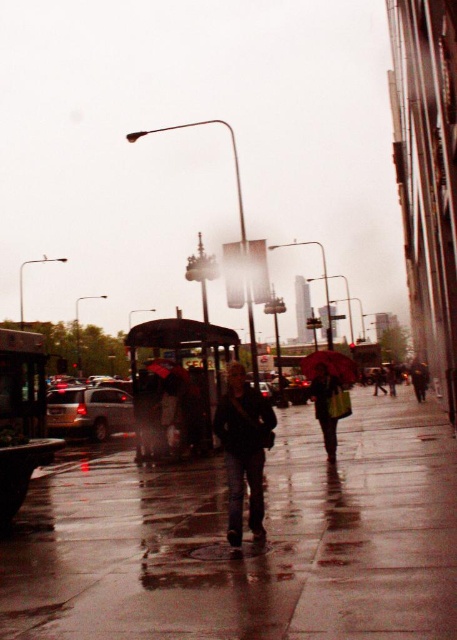
This screenshot has width=457, height=640. Find the location of `black plastic bus stop at center`. black plastic bus stop at center is located at coordinates (176, 385).

Does black plastic bus stop at center appear on the left side of raincoat fabric umbrella at center?

Correct, you'll find black plastic bus stop at center to the left of raincoat fabric umbrella at center.

Where is `black plastic bus stop at center`? black plastic bus stop at center is located at coordinates (176, 385).

In order to click on black plastic bus stop at center in this screenshot , I will do `click(176, 385)`.

Locate an element on the screen. dark blue leather jacket at center is located at coordinates (244, 449).

Who is more forward, (239, 400) or (323, 387)?

Point (239, 400) is in front.

The image size is (457, 640). Find the location of `dark blue leather jacket at center`. dark blue leather jacket at center is located at coordinates (244, 449).

Is dark blue leather jacket at center taller than dark red fabric umbrella at center?

No.

Is dark blue leather jacket at center closer to camera compared to dark red fabric umbrella at center?

Yes.

The width and height of the screenshot is (457, 640). In order to click on dark blue leather jacket at center in this screenshot , I will do `click(244, 449)`.